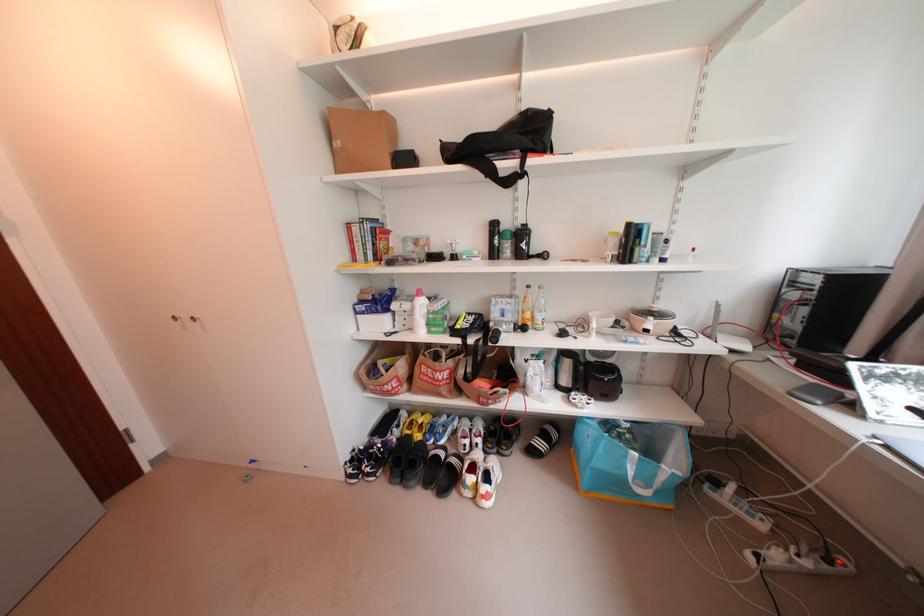
This screenshot has width=924, height=616. I want to click on pot lid handle, so click(x=655, y=326).